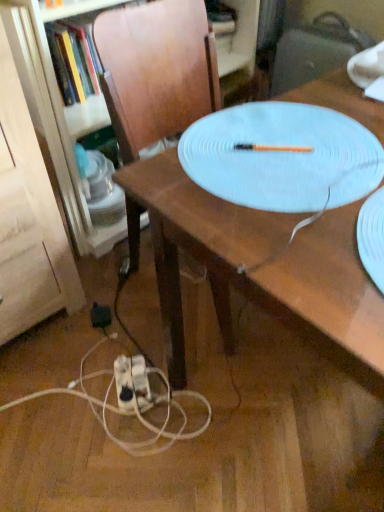
This screenshot has height=512, width=384. What are the coordinates of `free spot in front of white plastic extension cord at lower center` in the screenshot? It's located at (x=125, y=443).